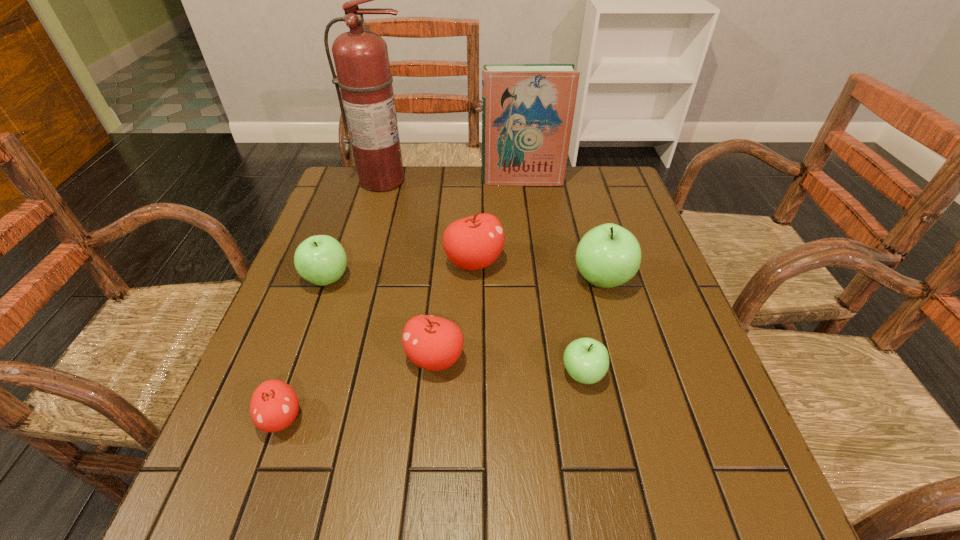
Where is `free spot located 0.160m on the cover of the hardback book`? The image size is (960, 540). free spot located 0.160m on the cover of the hardback book is located at coordinates (527, 218).

This screenshot has width=960, height=540. What are the coordinates of `vacant area situated 0.130m on the front of the biggest green apple` in the screenshot? It's located at (621, 348).

Locate an element on the screen. The height and width of the screenshot is (540, 960). free space located 0.070m on the left of the biggest red apple is located at coordinates (417, 262).

At what (x,y) coordinates should I click in order to perform the action: click on vacant position located 0.070m on the back of the leftmost green apple. Please return your answer as a coordinate pair (x, y). This screenshot has width=960, height=540. Looking at the image, I should click on (339, 245).

Identify the location of free region located 0.180m on the back of the second nearest red apple. The width and height of the screenshot is (960, 540). (442, 278).

Find the location of a particular element. This screenshot has height=540, width=960. free location located 0.350m on the left of the nearest green apple is located at coordinates (381, 374).

Image resolution: width=960 pixels, height=540 pixels. In order to click on blank space located on the back of the nearest object in this screenshot , I will do `click(305, 349)`.

Locate an element on the screen. This screenshot has width=960, height=540. fire extinguisher situated at the far edge is located at coordinates (361, 59).

What are the coordinates of `hardback book situated at the far edge` in the screenshot? It's located at (527, 109).

Identify the location of fire extinguisher present at the left edge. (361, 59).